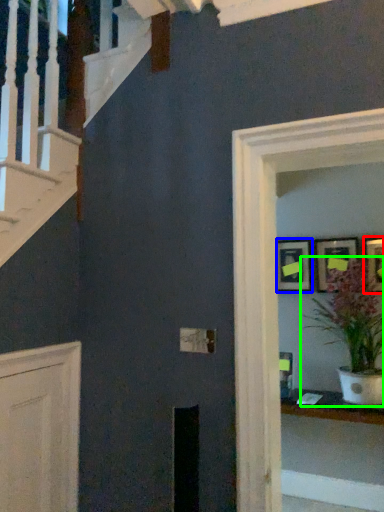
Question: Based on their relative distances, which object is farther from picture frame (highlighted by a red box)? Choose from picture frame (highlighted by a blue box) and houseplant (highlighted by a green box).

Choices:
 (A) picture frame
 (B) houseplant

Answer: (A)